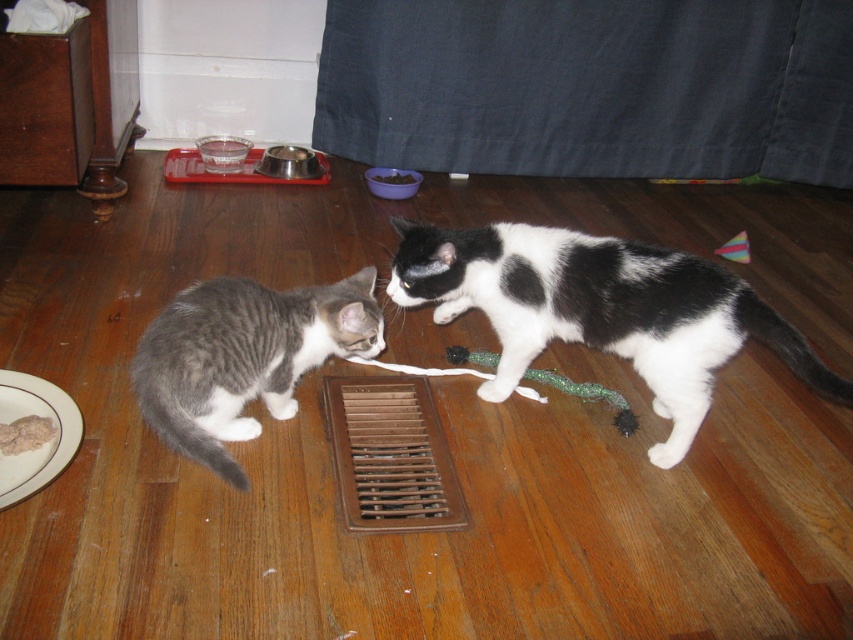
Based on the photo, can you confirm if black and white fur at center is shorter than gray tabby cat at lower left?

In fact, black and white fur at center may be taller than gray tabby cat at lower left.

Is point (489, 298) less distant than point (251, 378)?

No.

Identify the location of black and white fur at center. The image size is (853, 640). (601, 310).